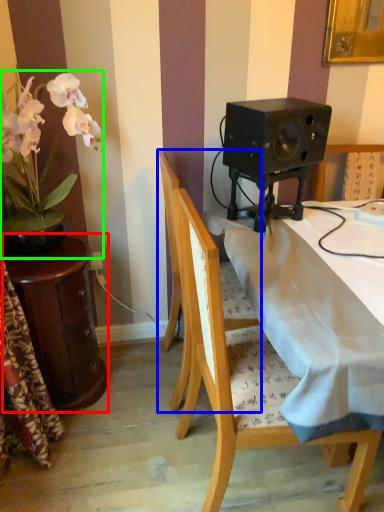
Question: Which object is the closest to the table (highlighted by a red box)? Choose among these: chair (highlighted by a blue box) or houseplant (highlighted by a green box).

Choices:
 (A) chair
 (B) houseplant

Answer: (B)